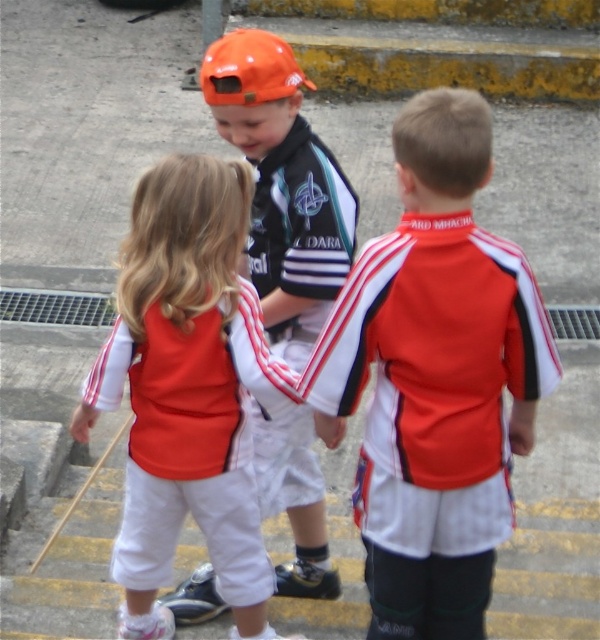
You are a photographer trying to capture a group photo of the matte red jersey at center and the orange matte baseball cap at center. To ensure both are visible, you need to know their positions relative to each other. Which object is located to the left of the other?

The matte red jersey at center is positioned on the right side of the orange matte baseball cap at center, so the orange matte baseball cap at center is to the left of the matte red jersey at center.

You are a photographer trying to capture a photo of the matte red jersey at center and the orange matte baseball cap at center. Which object should you focus on first if you want to ensure both are in focus?

You should focus on the matte red jersey at center first since it is closer to the viewer than the orange matte baseball cap at center, allowing the camera to adjust focus starting from the nearest object.